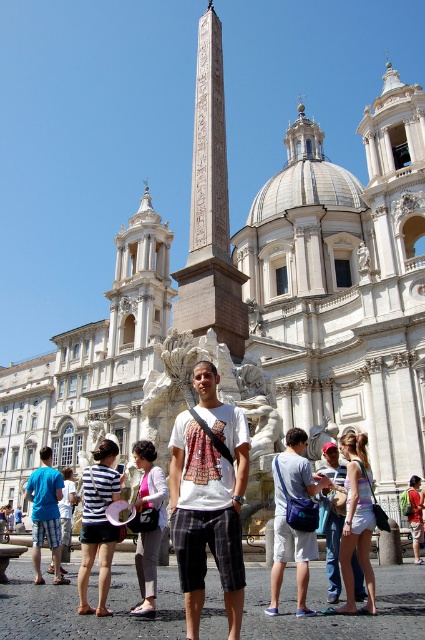
Between white cotton shirt at center and red shirt at center, which one appears on the left side from the viewer's perspective?

white cotton shirt at center is more to the left.

Based on the photo, is white cotton shirt at center thinner than red shirt at center?

In fact, white cotton shirt at center might be wider than red shirt at center.

From the picture: Who is more distant from viewer, (153, 483) or (413, 534)?

Positioned behind is point (413, 534).

I want to click on white cotton shirt at center, so click(x=150, y=528).

Between point (232, 355) and point (91, 486), which one is positioned behind?

The point (232, 355) is behind.

Locate an element on the screen. This screenshot has width=425, height=640. carved stone obelisk at center is located at coordinates (210, 211).

Find the location of a particular element. Image resolution: width=425 pixels, height=640 pixels. carved stone obelisk at center is located at coordinates (210, 211).

Is matte gray bag at center further to camera compared to red shirt at center?

No, it is in front of red shirt at center.

Is point (289, 531) closer to viewer compared to point (419, 497)?

Yes, point (289, 531) is in front of point (419, 497).

The image size is (425, 640). Describe the element at coordinates (289, 554) in the screenshot. I see `matte gray bag at center` at that location.

Image resolution: width=425 pixels, height=640 pixels. I want to click on matte gray bag at center, so click(289, 554).